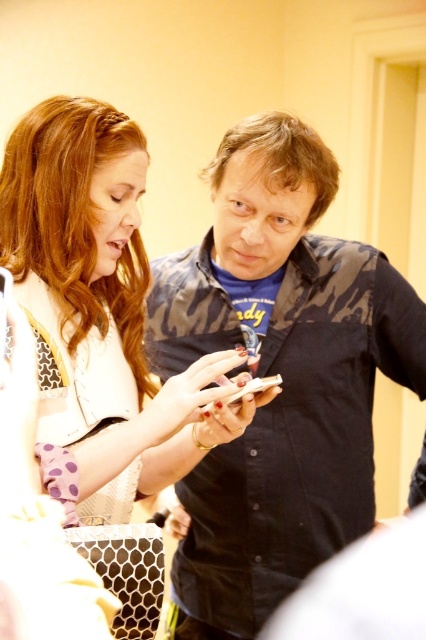
Who is lower down, camo-patterned shirt at center or white textured shirt at center?

camo-patterned shirt at center

Does camo-patterned shirt at center appear on the right side of white textured shirt at center?

Yes, camo-patterned shirt at center is to the right of white textured shirt at center.

This screenshot has width=426, height=640. Describe the element at coordinates (279, 372) in the screenshot. I see `camo-patterned shirt at center` at that location.

Where is `camo-patterned shirt at center`? camo-patterned shirt at center is located at coordinates (279, 372).